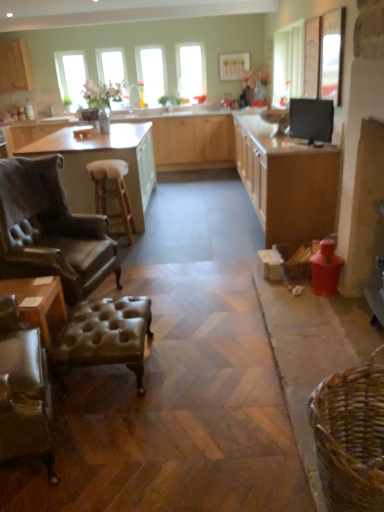
Question: Does brown leather table at left, which is counted as the second table, starting from the bottom, have a smaller size compared to matte wood countertop at center?

Choices:
 (A) no
 (B) yes

Answer: (B)

Question: Is the position of brown leather table at left, positioned as the first table in back-to-front order, more distant than that of matte wood countertop at center?

Choices:
 (A) no
 (B) yes

Answer: (A)

Question: Considering the relative sizes of brown leather table at left, positioned as the first table in back-to-front order, and matte wood countertop at center in the image provided, is brown leather table at left, positioned as the first table in back-to-front order, shorter than matte wood countertop at center?

Choices:
 (A) no
 (B) yes

Answer: (A)

Question: Is brown leather table at left, the 1th table positioned from the top, wider than matte wood countertop at center?

Choices:
 (A) yes
 (B) no

Answer: (A)

Question: Is brown leather table at left, positioned as the first table in back-to-front order, to the right of matte wood countertop at center from the viewer's perspective?

Choices:
 (A) no
 (B) yes

Answer: (B)

Question: Is brown leather table at left, which is the 2th table from front to back, in front of or behind brown woven basket at lower right in the image?

Choices:
 (A) behind
 (B) front

Answer: (A)

Question: From the image's perspective, is brown leather table at left, the 1th table positioned from the top, positioned above or below brown woven basket at lower right?

Choices:
 (A) below
 (B) above

Answer: (B)

Question: Is brown leather table at left, the 1th table positioned from the top, taller or shorter than brown woven basket at lower right?

Choices:
 (A) short
 (B) tall

Answer: (B)

Question: Considering the positions of brown leather table at left, the 1th table positioned from the top, and brown woven basket at lower right in the image, is brown leather table at left, the 1th table positioned from the top, wider or thinner than brown woven basket at lower right?

Choices:
 (A) thin
 (B) wide

Answer: (B)

Question: From a real-world perspective, is wooden cabinet at right, arranged as the 1th cabinetry when viewed from the right, above or below leather tufted stool at lower left?

Choices:
 (A) below
 (B) above

Answer: (B)

Question: From the image's perspective, relative to leather tufted stool at lower left, is wooden cabinet at right, arranged as the 1th cabinetry when viewed from the right, above or below?

Choices:
 (A) below
 (B) above

Answer: (B)

Question: In the image, is wooden cabinet at right, which ranks as the third cabinetry in left-to-right order, on the left side or the right side of leather tufted stool at lower left?

Choices:
 (A) left
 (B) right

Answer: (B)

Question: Is point (284, 184) closer or farther from the camera than point (76, 310)?

Choices:
 (A) closer
 (B) farther

Answer: (B)

Question: Would you say clear glass window at upper left, the third window viewed from the right, is inside or outside matte wood countertop at center?

Choices:
 (A) outside
 (B) inside

Answer: (A)

Question: In the image, is clear glass window at upper left, the third window viewed from the right, positioned in front of or behind matte wood countertop at center?

Choices:
 (A) front
 (B) behind

Answer: (B)